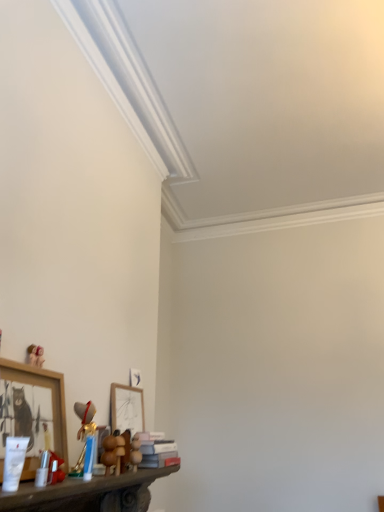
Question: Are matte white picture frame at center, placed as the 2th picture frame when sorted from left to right, and matte pink teddy bear at lower left, the 3th toy from the right, beside each other?

Choices:
 (A) no
 (B) yes

Answer: (A)

Question: Is matte pink teddy bear at lower left, marked as the first toy in a top-to-bottom arrangement, at the back of matte white picture frame at center, the 2th picture frame in the front-to-back sequence?

Choices:
 (A) yes
 (B) no

Answer: (B)

Question: From a real-world perspective, does matte white picture frame at center, the 2th picture frame in the front-to-back sequence, stand above matte pink teddy bear at lower left, which is the 1th toy in left-to-right order?

Choices:
 (A) yes
 (B) no

Answer: (B)

Question: Is matte white picture frame at center, which is the first picture frame from right to left, in front of matte pink teddy bear at lower left, marked as the first toy in a top-to-bottom arrangement?

Choices:
 (A) yes
 (B) no

Answer: (B)

Question: In terms of size, does brown plush bear at lower center, which is the first toy from bottom to top, appear bigger or smaller than wooden carved shelf at lower left?

Choices:
 (A) big
 (B) small

Answer: (B)

Question: Is point (132, 463) positioned closer to the camera than point (51, 496)?

Choices:
 (A) farther
 (B) closer

Answer: (A)

Question: From a real-world perspective, is brown plush bear at lower center, marked as the 3th toy in a top-to-bottom arrangement, positioned above or below wooden carved shelf at lower left?

Choices:
 (A) below
 (B) above

Answer: (B)

Question: Would you say brown plush bear at lower center, which is the first toy from bottom to top, is to the left or to the right of wooden carved shelf at lower left in the picture?

Choices:
 (A) right
 (B) left

Answer: (A)

Question: Is wooden bear at lower center, the 2th toy in the top-to-bottom sequence, in front of or behind wooden picture frame at lower left, which is the second picture frame from right to left, in the image?

Choices:
 (A) front
 (B) behind

Answer: (B)

Question: Is wooden bear at lower center, the second toy ordered from the bottom, to the left or to the right of wooden picture frame at lower left, which is the second picture frame from right to left, in the image?

Choices:
 (A) left
 (B) right

Answer: (B)

Question: In terms of height, does wooden bear at lower center, the second toy ordered from the bottom, look taller or shorter compared to wooden picture frame at lower left, marked as the first picture frame in a front-to-back arrangement?

Choices:
 (A) tall
 (B) short

Answer: (B)

Question: In terms of width, does wooden bear at lower center, acting as the 2th toy starting from the right, look wider or thinner when compared to wooden picture frame at lower left, which is the second picture frame from right to left?

Choices:
 (A) thin
 (B) wide

Answer: (A)

Question: Considering the relative positions of wooden picture frame at lower left, which is the second picture frame from right to left, and matte pink teddy bear at lower left, the 3th toy from the right, in the image provided, is wooden picture frame at lower left, which is the second picture frame from right to left, to the left or to the right of matte pink teddy bear at lower left, the 3th toy from the right,?

Choices:
 (A) right
 (B) left

Answer: (A)

Question: Is wooden picture frame at lower left, marked as the first picture frame in a front-to-back arrangement, in front of or behind matte pink teddy bear at lower left, the second toy viewed from the back, in the image?

Choices:
 (A) behind
 (B) front

Answer: (B)